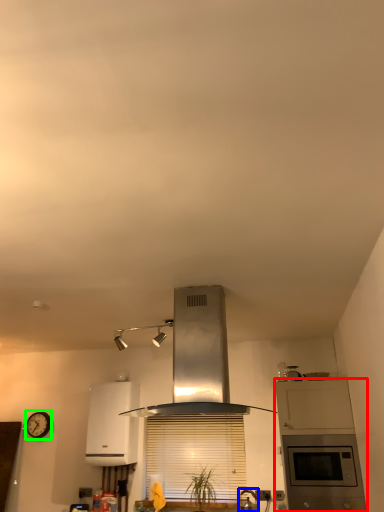
Question: Which object is the closest to the cabinetry (highlighted by a red box)? Choose among these: kitchen appliance (highlighted by a blue box) or clock (highlighted by a green box).

Choices:
 (A) kitchen appliance
 (B) clock

Answer: (A)